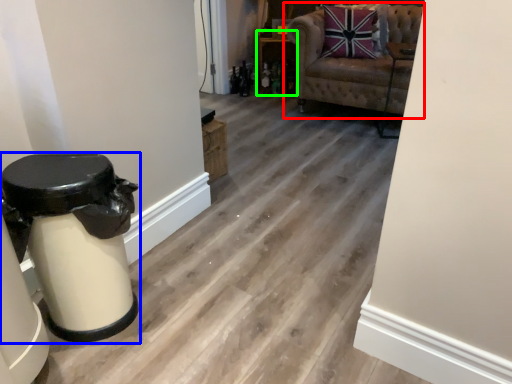
Question: Estimate the real-world distances between objects in this image. Which object is closer to chair (highlighted by a red box), bar stool (highlighted by a blue box) or furniture (highlighted by a green box)?

Choices:
 (A) bar stool
 (B) furniture

Answer: (B)